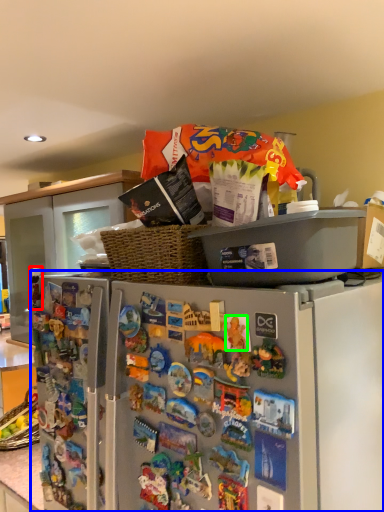
Question: Based on their relative distances, which object is nearer to toy (highlighted by a red box)? Choose from refrigerator (highlighted by a blue box) and toy (highlighted by a green box).

Choices:
 (A) refrigerator
 (B) toy

Answer: (A)